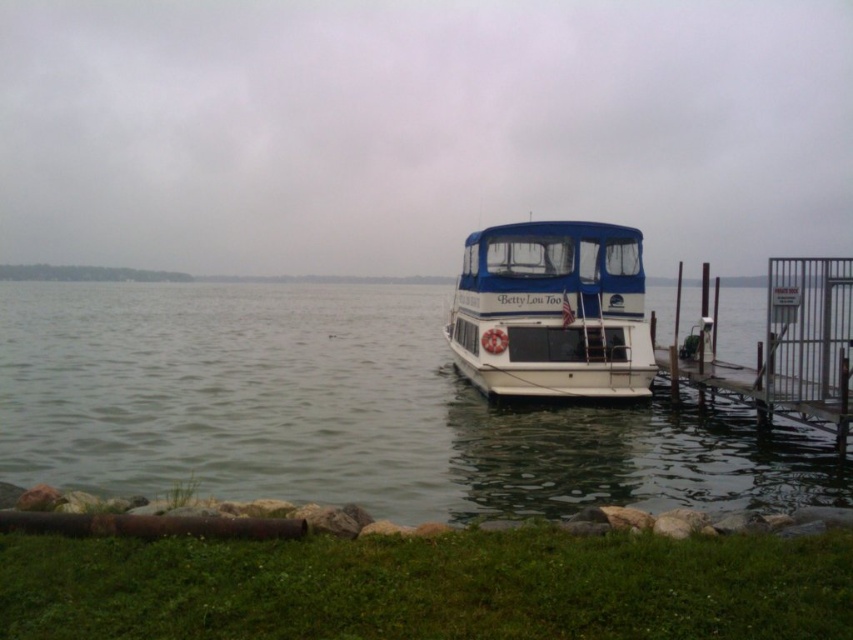
Is point (264, 451) positioned before point (502, 317)?

Yes, point (264, 451) is in front of point (502, 317).

From the picture: Can you confirm if clear water at center is bigger than white glossy houseboat at center?

Yes, clear water at center is bigger than white glossy houseboat at center.

What are the coordinates of `clear water at center` in the screenshot? It's located at (347, 410).

Find the location of `clear water at center`. clear water at center is located at coordinates (347, 410).

Which is more to the right, clear water at center or metallic gray dock at lower right?

metallic gray dock at lower right is more to the right.

Find the location of `clear water at center`. clear water at center is located at coordinates (347, 410).

I want to click on clear water at center, so point(347,410).

Does white glossy houseboat at center appear on the left side of metallic gray dock at lower right?

Indeed, white glossy houseboat at center is positioned on the left side of metallic gray dock at lower right.

Is white glossy houseboat at center wider than metallic gray dock at lower right?

No.

Image resolution: width=853 pixels, height=640 pixels. In order to click on white glossy houseboat at center in this screenshot , I will do `click(552, 310)`.

You are a GUI agent. You are given a task and a screenshot of the screen. Output one action in this format:
    pyautogui.click(x=<x>, y=<y>)
    Task: Click on the white glossy houseboat at center
    
    Given the screenshot: What is the action you would take?
    pyautogui.click(x=552, y=310)